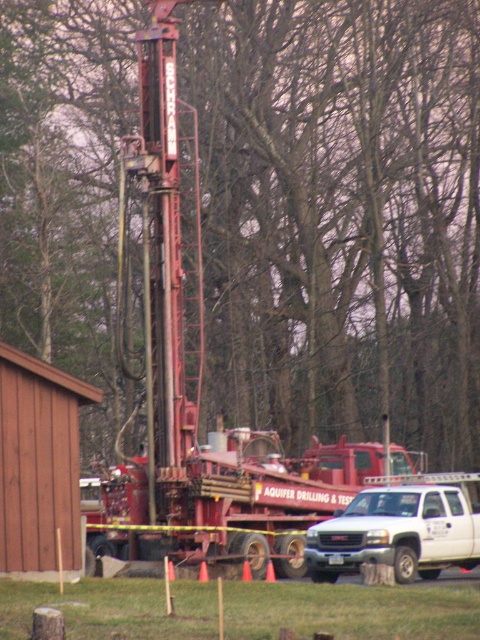
You are a safety inspector at the drilling site. You need to ensure that the bare branches at center are at least 20 meters away from the white matte truck at lower right for safety regulations. Based on the provided information, is the current distance compliant with the safety requirement?

The bare branches at center are 18.04 meters from the white matte truck at lower right, which is less than the required 20 meters. Therefore, the current distance does not comply with the safety requirement.

Looking at this image, you are a worker at the drilling site. You need to determine if the bare branches at center could block the view of the white matte truck at lower right from your current position. Can you see the truck?

The bare branches at center are taller than the white matte truck at lower right, so they might block the view of the truck depending on their exact position and spread.

You are standing at the point with coordinates point [251,58] and want to move to the point with coordinates point [388,493]. Is the point you want to reach in front of or behind you?

The point [388,493] is in front of you because point [251,58] is behind point [388,493].